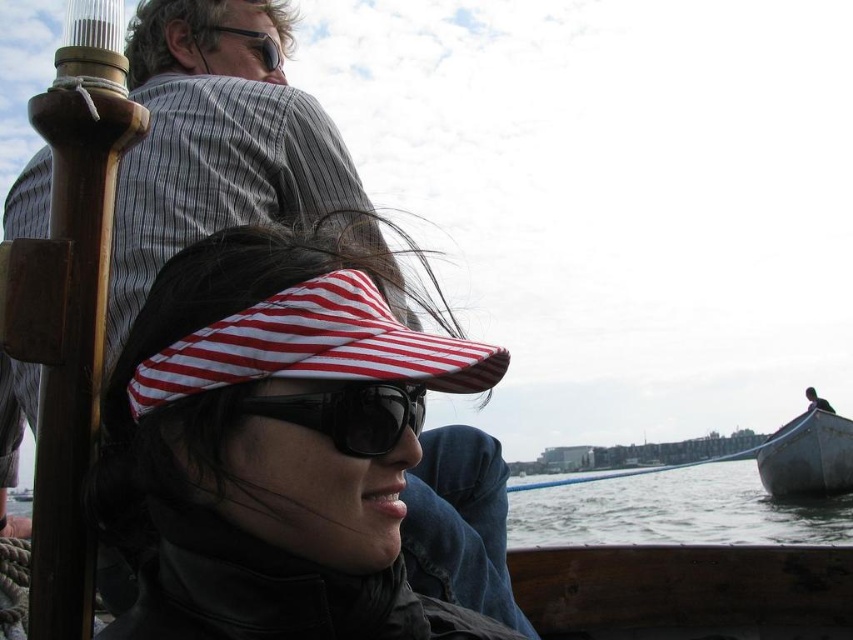
In the scene shown: Does striped fabric sun visor at center appear over clear water at lower right?

Yes.

Is striped fabric sun visor at center to the left of clear water at lower right from the viewer's perspective?

Correct, you'll find striped fabric sun visor at center to the left of clear water at lower right.

Who is more distant from viewer, (492, 621) or (741, 509)?

Point (741, 509)

Where is `striped fabric sun visor at center`? The image size is (853, 640). striped fabric sun visor at center is located at coordinates (276, 448).

Is clear water at lower right wider than dark gray wooden boat at lower right?

Correct, the width of clear water at lower right exceeds that of dark gray wooden boat at lower right.

Can you confirm if clear water at lower right is positioned to the left of dark gray wooden boat at lower right?

Incorrect, clear water at lower right is not on the left side of dark gray wooden boat at lower right.

Where is `clear water at lower right`? clear water at lower right is located at coordinates (675, 509).

The width and height of the screenshot is (853, 640). Describe the element at coordinates (276, 448) in the screenshot. I see `striped fabric sun visor at center` at that location.

At what (x,y) coordinates should I click in order to perform the action: click on striped fabric sun visor at center. Please return your answer as a coordinate pair (x, y). Looking at the image, I should click on (276, 448).

Is point (286, 445) more distant than point (844, 438)?

No, it is not.

Locate an element on the screen. striped fabric sun visor at center is located at coordinates point(276,448).